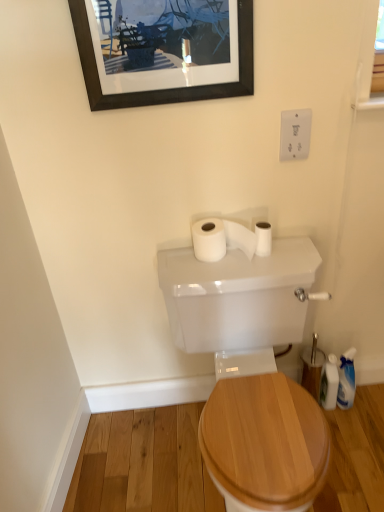
This screenshot has height=512, width=384. What are the coordinates of `vacant area located to the right-hand side of white matte toilet paper at upper center, which appears as the first toilet paper when viewed from the left` in the screenshot? It's located at (282, 257).